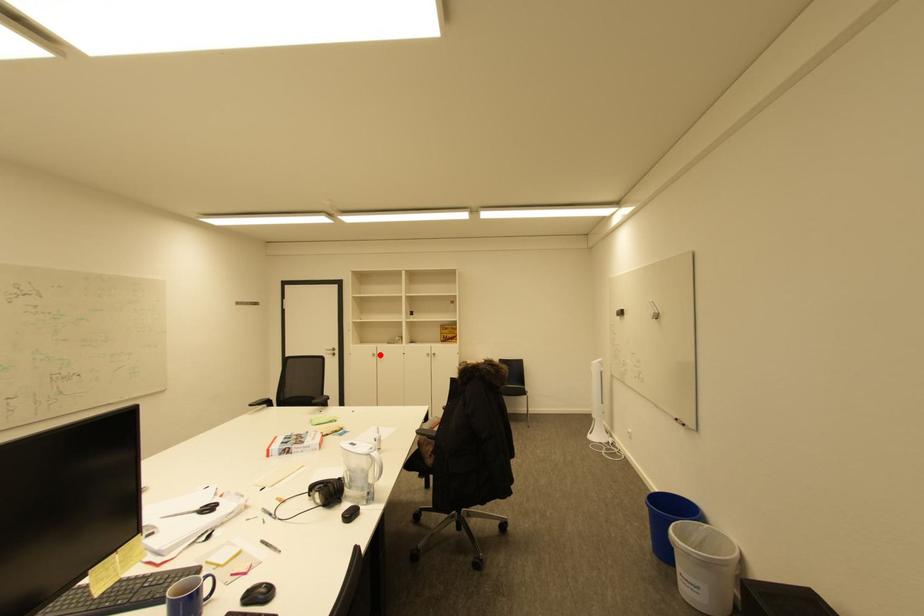
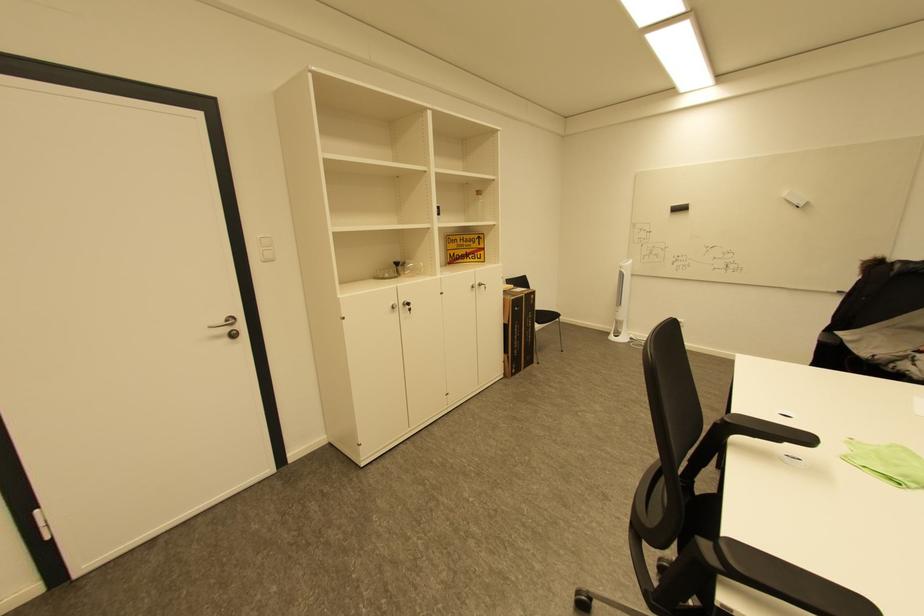
The point at the highlighted location is marked in the first image. Where is the corresponding point in the second image?

(398, 308)